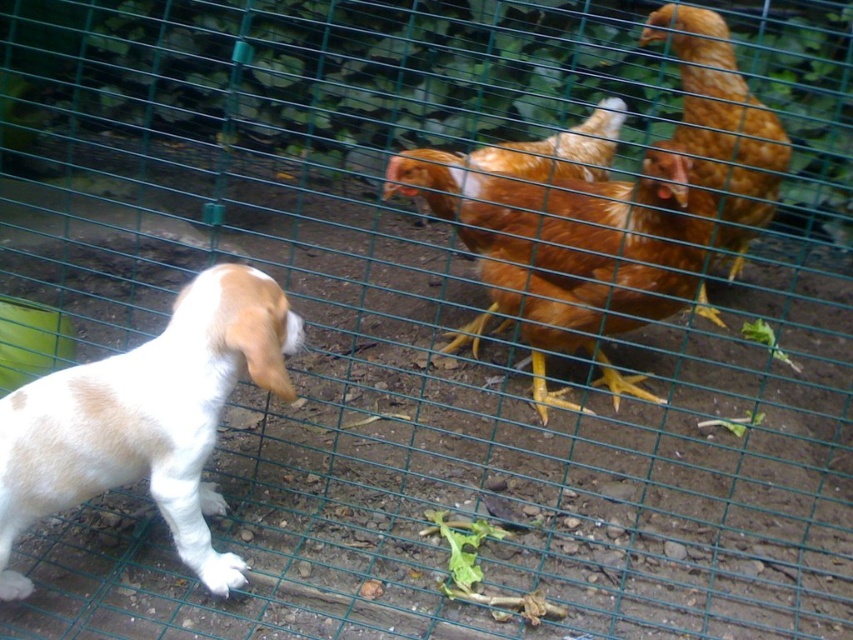
You are a drone operator trying to capture a photo of the white fur dog at left. The drone is currently at coordinates 0.5, 0.5. Can you determine if the drone needs to move left or right to align with the dog?

The white fur dog at left is at point (148, 419). Since the drone is at (426, 320), it needs to move right to align with the dog.

Looking at this image, you are a birdwatcher observing the golden brown feathers at center and the golden feathered chicken at upper right. Which one is shorter?

The golden brown feathers at center is shorter than the golden feathered chicken at upper right.